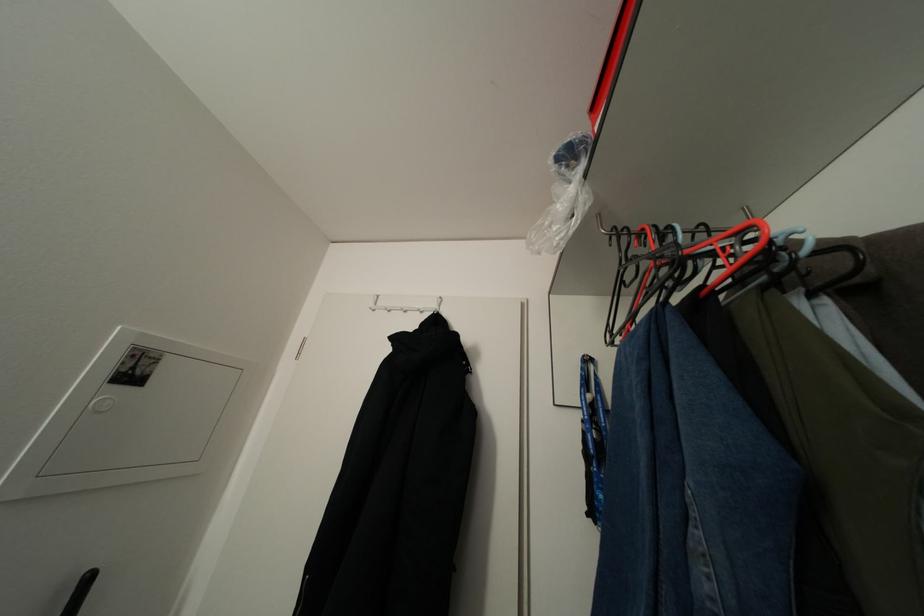
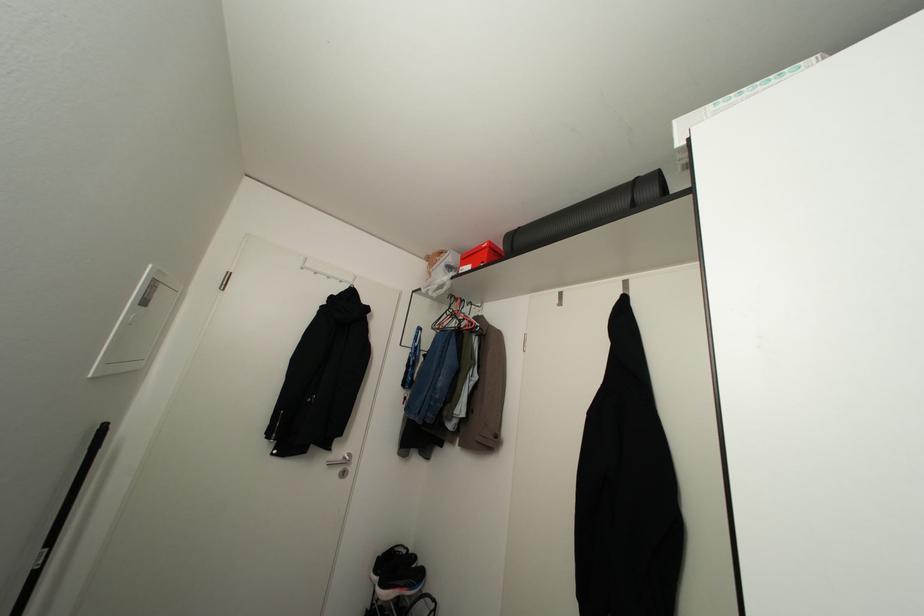
Locate, in the second image, the point that corresponds to (616,232) in the first image.

(451, 294)